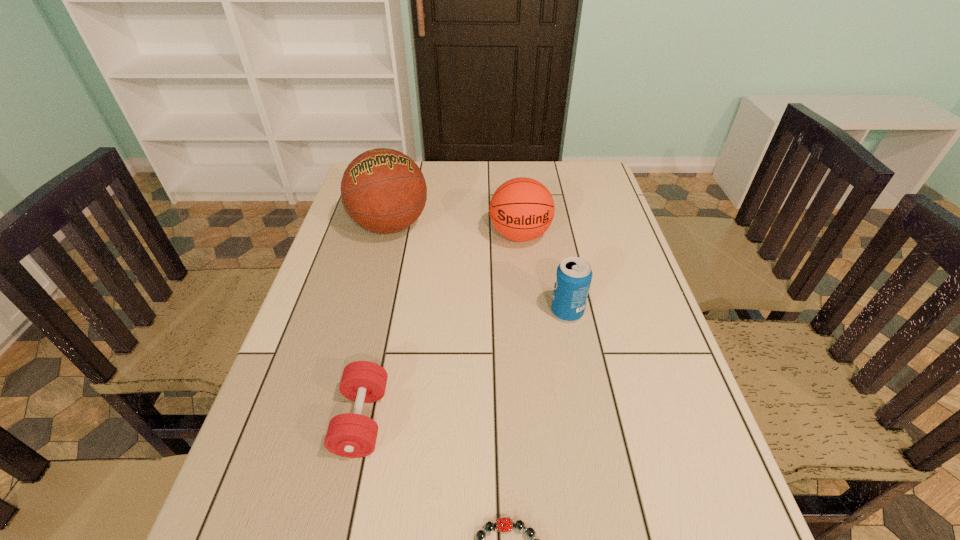
Where is `vacant point located between the second nearest object and the tallest object`? vacant point located between the second nearest object and the tallest object is located at coordinates (376, 323).

This screenshot has height=540, width=960. Find the location of `vacant space that's between the third shortest object and the left basketball`. vacant space that's between the third shortest object and the left basketball is located at coordinates (479, 269).

Identify the location of empty space that is in between the fourth shortest object and the fourth tallest object. This screenshot has width=960, height=540. (441, 328).

The width and height of the screenshot is (960, 540). What are the coordinates of `free spot between the dumbbell and the shorter basketball` in the screenshot? It's located at (441, 328).

Locate an element on the screen. the second closest object relative to the third nearest object is located at coordinates (384, 191).

Image resolution: width=960 pixels, height=540 pixels. Identify the location of object that is the fourth closest one to the dumbbell. (521, 209).

You are a GUI agent. You are given a task and a screenshot of the screen. Output one action in this format:
    pyautogui.click(x=<x>, y=<y>)
    Task: Click on the free space that satisfies the following two spatial constraints: 1. on the side with logo of the third tallest object; 2. on the left side of the shorter basketball
    
    Given the screenshot: What is the action you would take?
    pyautogui.click(x=528, y=312)